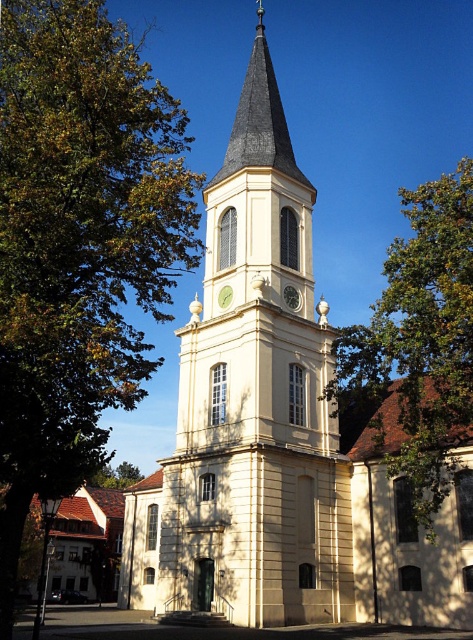
Can you confirm if green leafy tree at center is taller than metallic clock face at upper center?

Correct, green leafy tree at center is much taller as metallic clock face at upper center.

Who is positioned more to the left, green leafy tree at center or metallic clock face at upper center?

Positioned to the left is metallic clock face at upper center.

Who is more distant from viewer, [445,349] or [298,301]?

Positioned behind is point [298,301].

Locate an element on the screen. green leafy tree at center is located at coordinates (420, 340).

Does point (288, 572) come closer to viewer compared to point (220, 291)?

Yes, point (288, 572) is in front of point (220, 291).

Can you confirm if beige stone clock tower at center is positioned below gold metallic clock at center?

No, beige stone clock tower at center is not below gold metallic clock at center.

Is point (246, 144) positioned before point (227, 288)?

That is False.

What are the coordinates of `beige stone clock tower at center` in the screenshot? It's located at (256, 397).

Which of these two, metallic clock face at upper center or gold metallic clock at center, stands shorter?

Standing shorter between the two is gold metallic clock at center.

The height and width of the screenshot is (640, 473). What are the coordinates of `metallic clock face at upper center` in the screenshot? It's located at (291, 298).

Locate an element on the screen. The image size is (473, 640). metallic clock face at upper center is located at coordinates (291, 298).